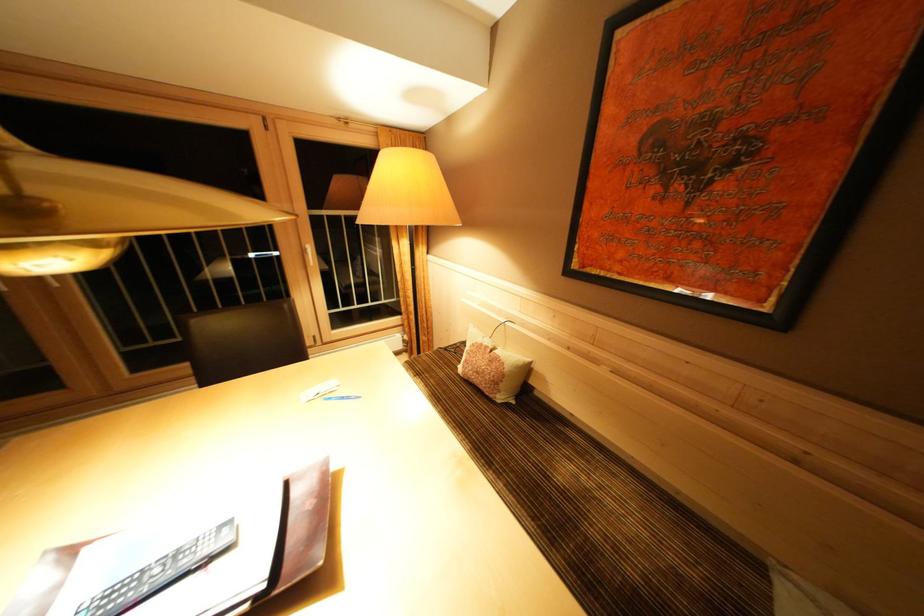
Where would you sit the sofa sitting surface? Please return your answer as a coordinate pair (x, y).

(600, 521)